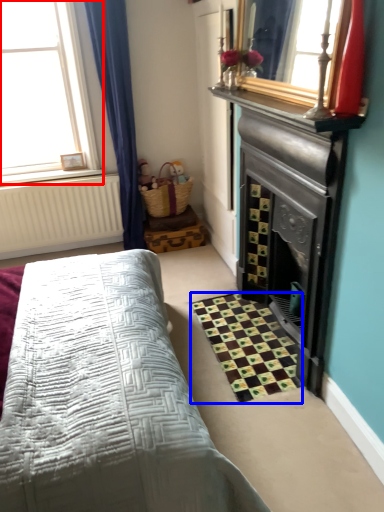
Question: Which of the following is the farthest to the observer, window (highlighted by a red box) or pattern (highlighted by a blue box)?

Choices:
 (A) window
 (B) pattern

Answer: (A)